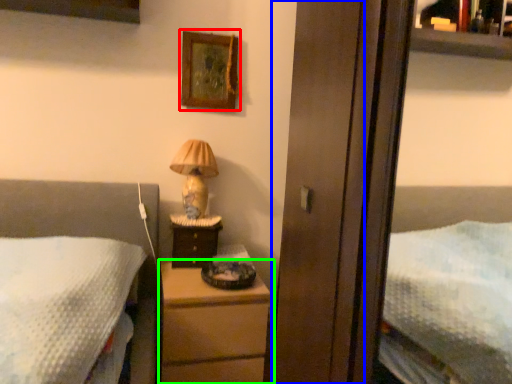
Question: Which object is positioned closest to picture frame (highlighted by a red box)? Select from screen door (highlighted by a blue box) and chest of drawers (highlighted by a green box).

Choices:
 (A) screen door
 (B) chest of drawers

Answer: (B)